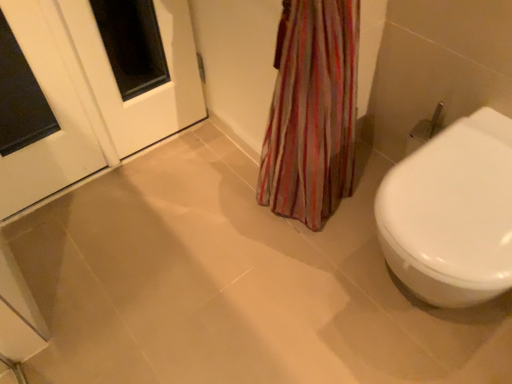
Locate an element on the screen. The width and height of the screenshot is (512, 384). free space between white glossy bidet at right and white glossy door at upper left is located at coordinates (214, 253).